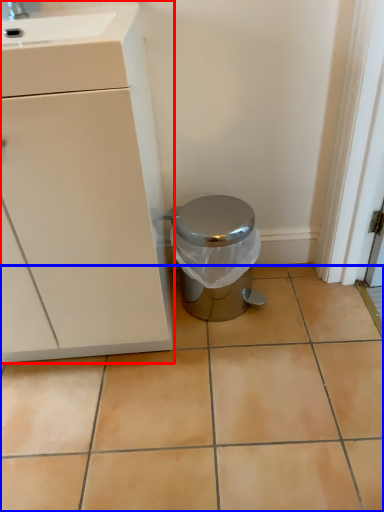
Question: Which object appears farthest to the camera in this image, cabinetry (highlighted by a red box) or ceramic tile (highlighted by a blue box)?

Choices:
 (A) cabinetry
 (B) ceramic tile

Answer: (B)